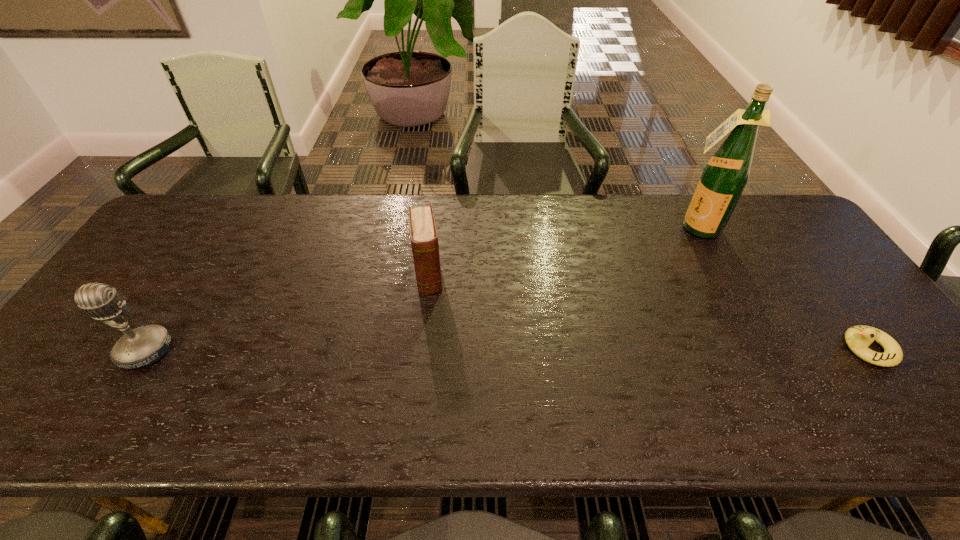
Where is `object that stands as the second closest to the third shortest object`? object that stands as the second closest to the third shortest object is located at coordinates (725, 176).

What are the coordinates of `free location that satisfies the following two spatial constraints: 1. on the front side of the third nearest object; 2. on the face of the rightmost object` in the screenshot? It's located at (420, 349).

Locate an element on the screen. free space that satisfies the following two spatial constraints: 1. on the front side of the tallest object; 2. on the face of the shortest object is located at coordinates (759, 349).

The image size is (960, 540). In order to click on blank space that satisfies the following two spatial constraints: 1. on the back side of the farthest object; 2. on the left side of the second object from left to right in this screenshot , I will do `click(434, 227)`.

Where is `vacant area in the image that satisfies the following two spatial constraints: 1. on the front side of the duckling; 2. on the face of the third tallest object`? This screenshot has height=540, width=960. vacant area in the image that satisfies the following two spatial constraints: 1. on the front side of the duckling; 2. on the face of the third tallest object is located at coordinates (420, 349).